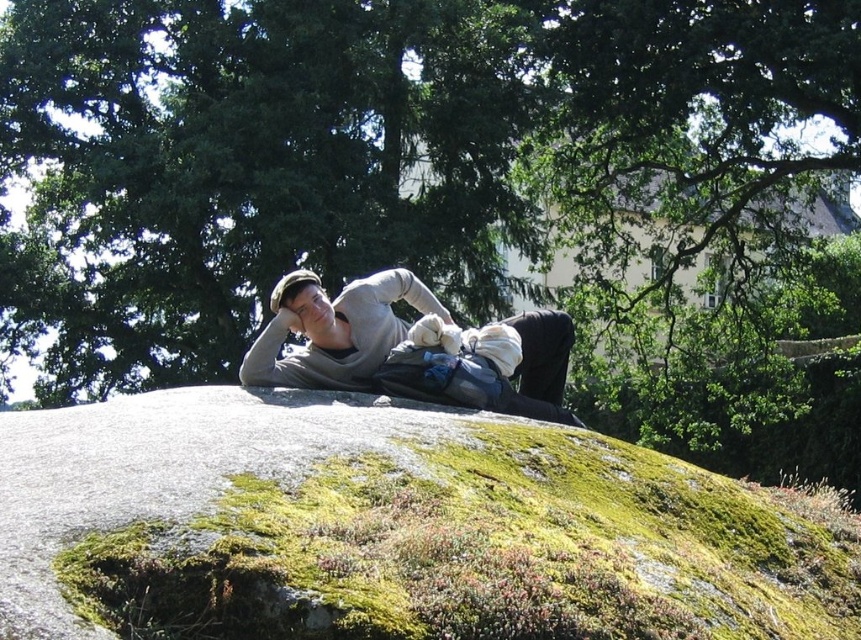
Is the position of green mossy rock at center more distant than that of gray cotton sweater at center?

No, it is in front of gray cotton sweater at center.

Which is behind, point (95, 513) or point (267, 364)?

Positioned behind is point (267, 364).

Image resolution: width=861 pixels, height=640 pixels. What are the coordinates of `green mossy rock at center` in the screenshot? It's located at (393, 529).

Between green leafy tree at upper center and gray cotton sweater at center, which one has more height?

With more height is green leafy tree at upper center.

Can you confirm if green leafy tree at upper center is taller than gray cotton sweater at center?

Indeed, green leafy tree at upper center has a greater height compared to gray cotton sweater at center.

Image resolution: width=861 pixels, height=640 pixels. What do you see at coordinates (387, 152) in the screenshot?
I see `green leafy tree at upper center` at bounding box center [387, 152].

You are a GUI agent. You are given a task and a screenshot of the screen. Output one action in this format:
    pyautogui.click(x=<x>, y=<y>)
    Task: Click on the green leafy tree at upper center
    
    Given the screenshot: What is the action you would take?
    pyautogui.click(x=387, y=152)

Can you confirm if green leafy tree at upper center is shorter than green mossy rock at center?

No, green leafy tree at upper center is not shorter than green mossy rock at center.

Can you confirm if green leafy tree at upper center is positioned to the right of green mossy rock at center?

Incorrect, green leafy tree at upper center is not on the right side of green mossy rock at center.

Is point (116, 253) closer to viewer compared to point (3, 632)?

No, (116, 253) is behind (3, 632).

Where is `green leafy tree at upper center`? This screenshot has height=640, width=861. green leafy tree at upper center is located at coordinates (387, 152).